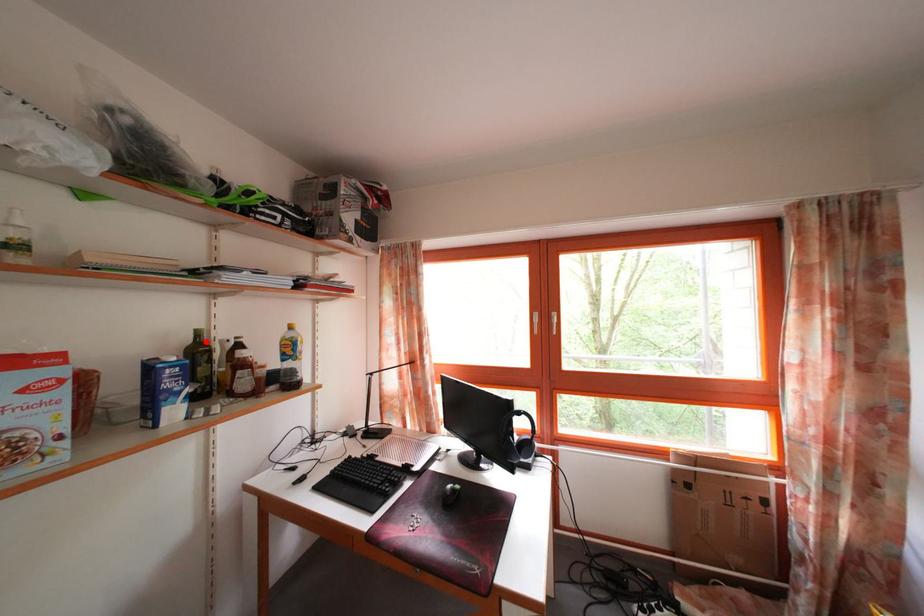
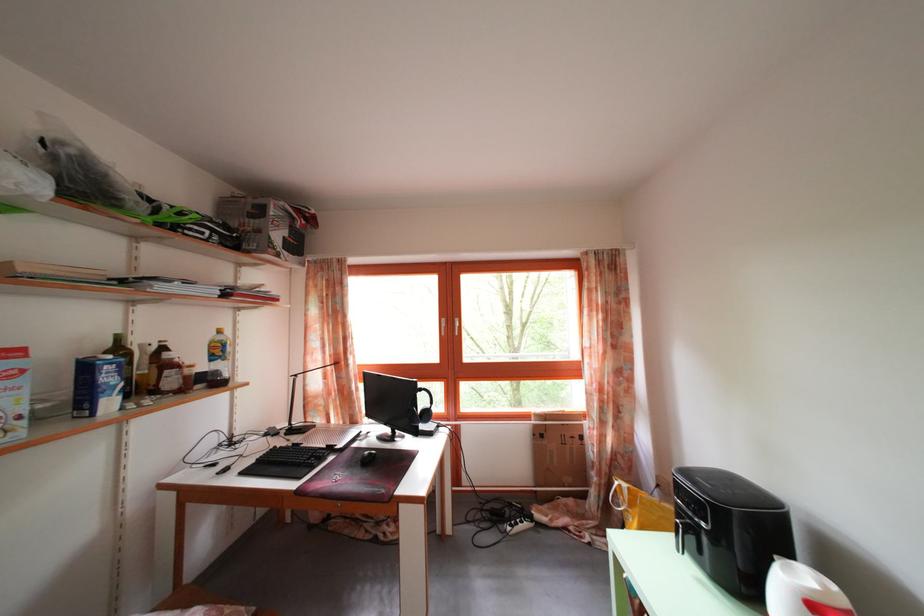
The point at the highlighted location is marked in the first image. Where is the corresponding point in the second image?

(126, 346)